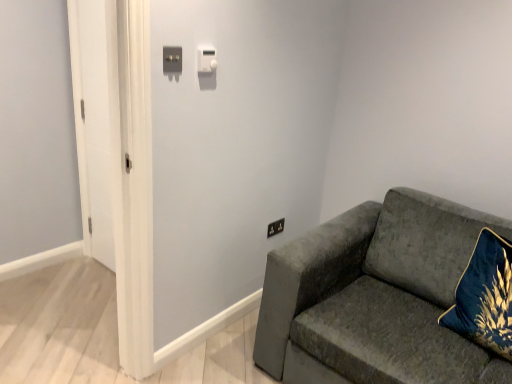
Question: Looking at their shapes, would you say satin silver switch at upper center, which appears as the 2th light switch when viewed from the right, is wider or thinner than white plastic light switch at upper center, placed as the 2th light switch when sorted from left to right?

Choices:
 (A) thin
 (B) wide

Answer: (A)

Question: From the image's perspective, is satin silver switch at upper center, which is the second light switch in back-to-front order, positioned above or below white plastic light switch at upper center, which is the second light switch in front-to-back order?

Choices:
 (A) above
 (B) below

Answer: (B)

Question: Which of these objects is positioned closest to the velvet gray couch at right?

Choices:
 (A) velvet blue pillow at right
 (B) white glossy door at left
 (C) black plastic electrical outlet at upper right
 (D) white plastic light switch at upper center, placed as the 2th light switch when sorted from left to right
 (E) satin silver switch at upper center, which is the second light switch in back-to-front order

Answer: (A)

Question: Which is farther from the white plastic light switch at upper center, which appears as the first light switch when viewed from the right?

Choices:
 (A) velvet blue pillow at right
 (B) velvet gray couch at right
 (C) white glossy door at left
 (D) satin silver switch at upper center, which appears as the 2th light switch when viewed from the right
 (E) black plastic electrical outlet at upper right

Answer: (A)